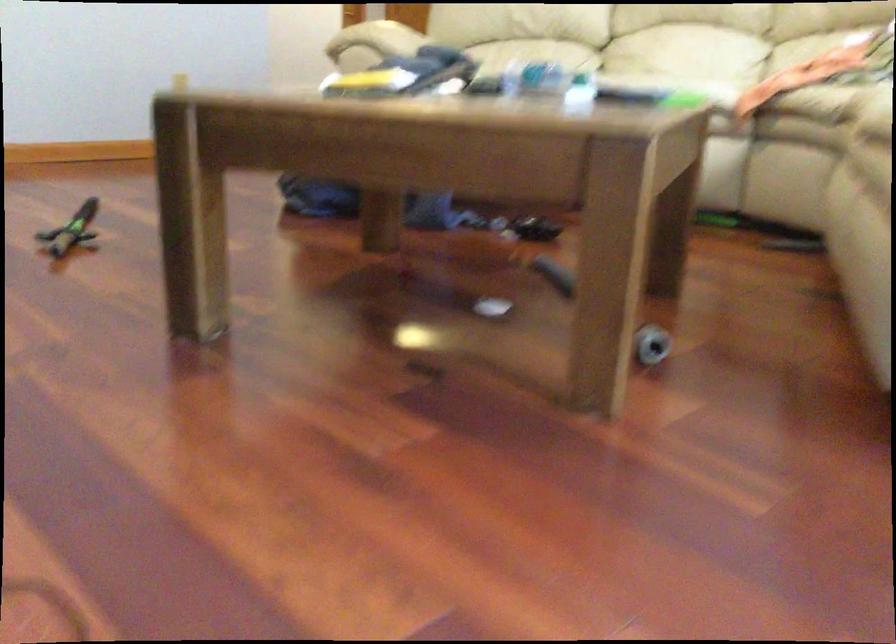
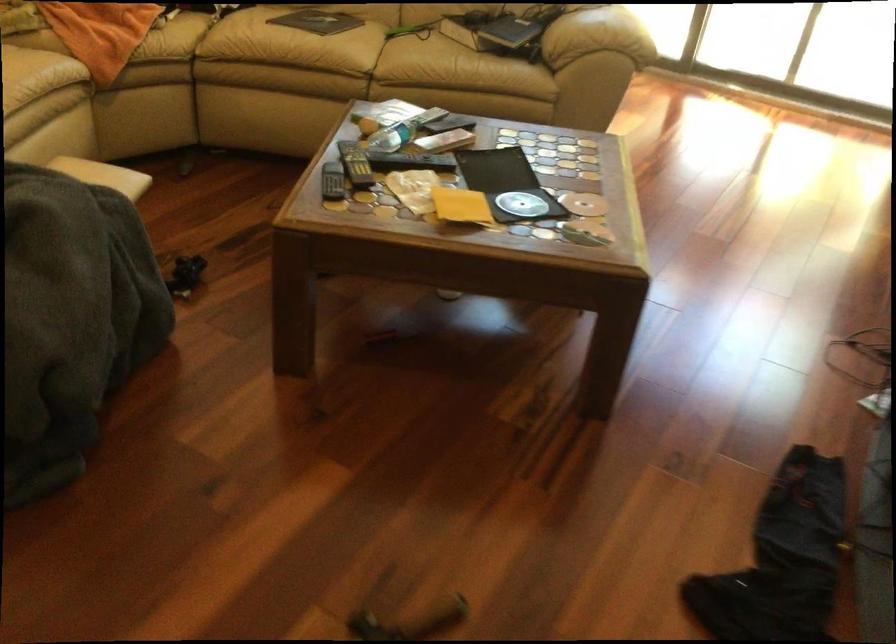
Where in the second image is the point corresponding to [455,79] from the first image?

(355, 164)